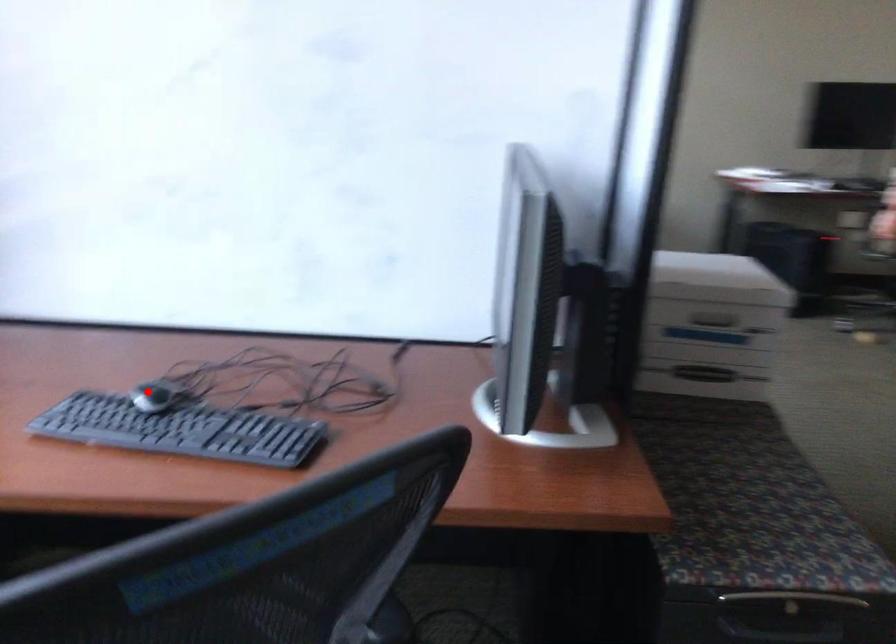
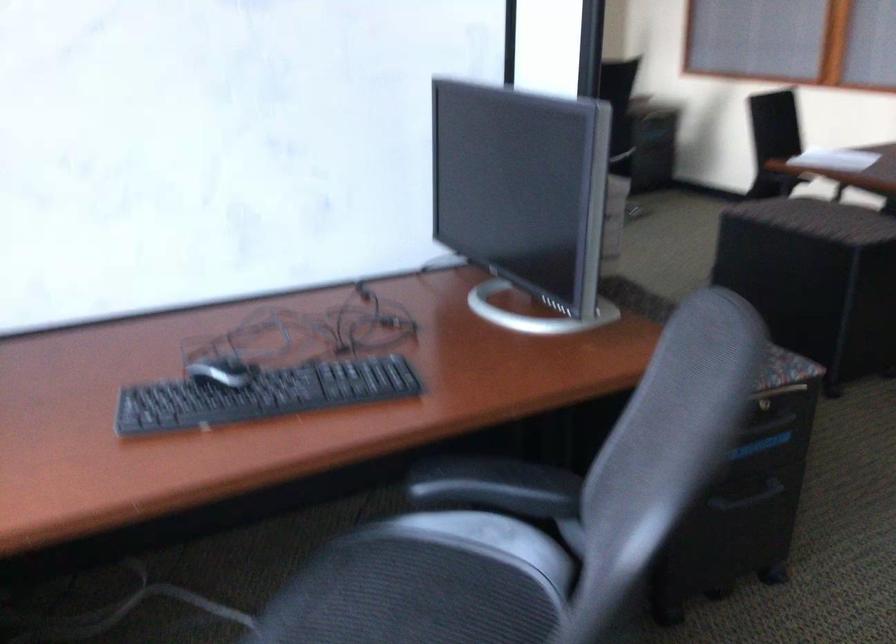
Question: I am providing you with two images of the same scene from different viewpoints. A red point is marked on the first image. Is the red point's position out of view in image 2?

Choices:
 (A) Yes
 (B) No

Answer: (B)